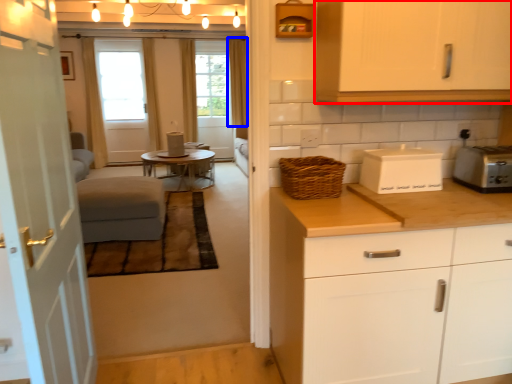
Question: Which of the following is the closest to the observer, cabinetry (highlighted by a red box) or curtain (highlighted by a blue box)?

Choices:
 (A) cabinetry
 (B) curtain

Answer: (A)